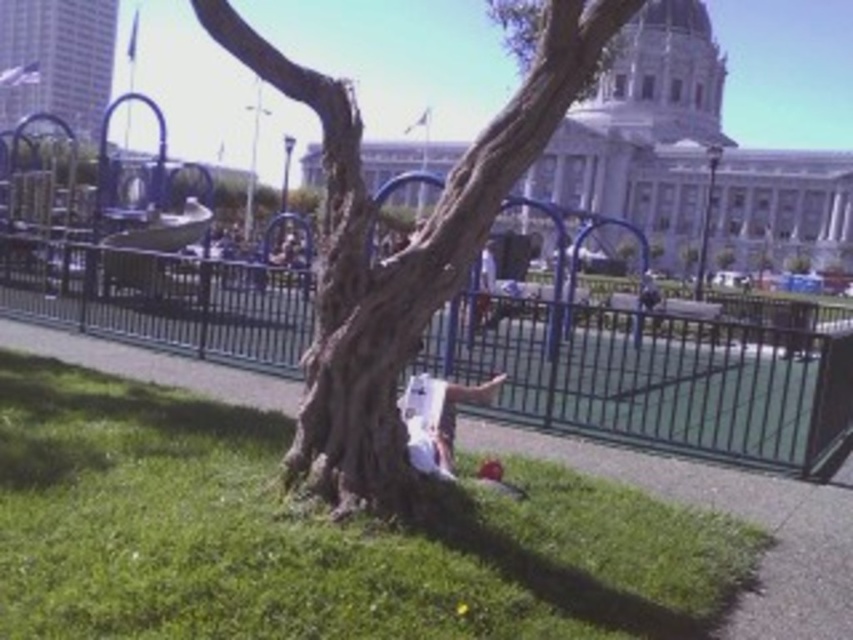
Question: Which point is closer to the camera?

Choices:
 (A) (831, 429)
 (B) (238, 442)
 (C) (352, 474)

Answer: (C)

Question: Is green grass at center bigger than black metal fence at center?

Choices:
 (A) yes
 (B) no

Answer: (B)

Question: Which of the following is the farthest from the observer?

Choices:
 (A) black metal fence at center
 (B) smooth bark tree at center

Answer: (A)

Question: Is green grass at center above black metal fence at center?

Choices:
 (A) no
 (B) yes

Answer: (A)

Question: Which point is closer to the camera taking this photo?

Choices:
 (A) (152, 392)
 (B) (570, 52)
 (C) (544, 337)

Answer: (B)

Question: Can you confirm if black metal fence at center is positioned below smooth bark tree at center?

Choices:
 (A) yes
 (B) no

Answer: (A)